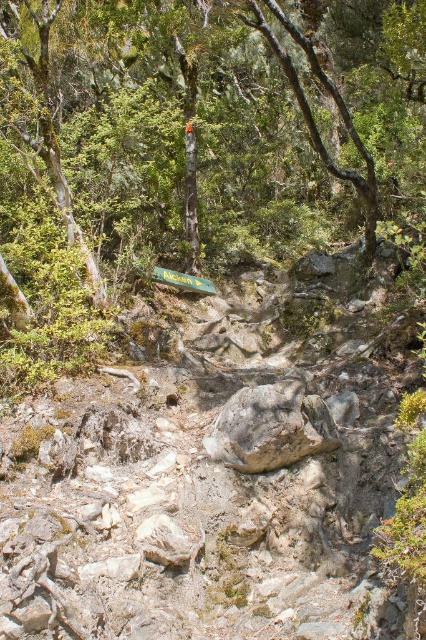
Question: From the image, what is the correct spatial relationship of green leafy tree at center in relation to gray rough rock at center?

Choices:
 (A) left
 (B) right

Answer: (A)

Question: Which of the following is the closest to the observer?

Choices:
 (A) (322, 417)
 (B) (126, 198)

Answer: (A)

Question: Can you confirm if green leafy tree at center is positioned to the right of gray rough rock at center?

Choices:
 (A) yes
 (B) no

Answer: (B)

Question: Is green leafy tree at center to the right of gray rough rock at center from the viewer's perspective?

Choices:
 (A) no
 (B) yes

Answer: (A)